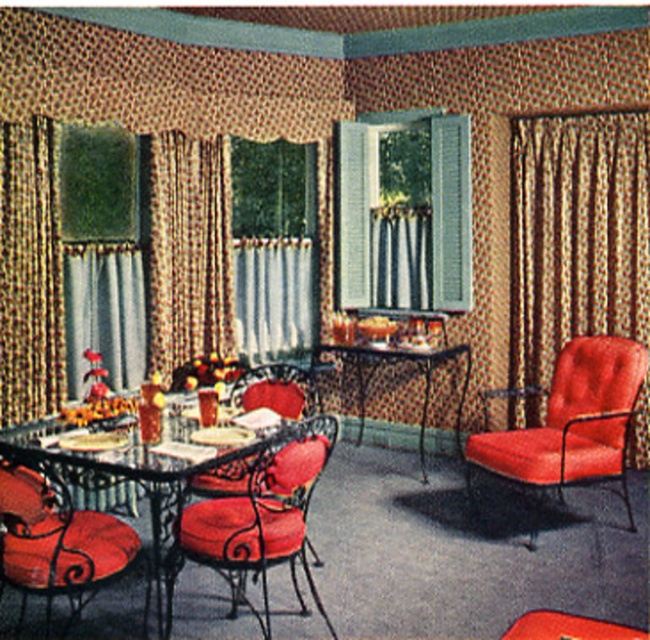
You are standing in the dining area and want to open the window to let some fresh air in. The window is located at the same position as the brown textured curtain at left. Can you reach the window if you are 1.7 meters tall?

The position of the brown textured curtain at left is at point (185,248). Since the window is at the same position, and assuming the coordinates are normalized between 0 and 1, the vertical position 0.286 would correspond to roughly 0.286 multiplied by the room height. If the room height is standard, say 2.5 meters, the window would be at about 0.715 meters from the floor. Since you are 1.7 meters tall, you can easily reach the window.

Consider the image. You are planning to hang a 12 inch wide painting between the brown textured curtain at left and the white sheer curtain at center. Is there enough space between them to fit the painting?

The brown textured curtain at left is 20.66 inches from the white sheer curtain at center. Since the painting is 12 inches wide, there is enough space between them to fit the painting.

You are a guest entering the dining area and notice the brown textured curtain at left and the white sheer curtain at center. Which curtain is positioned higher relative to the other?

The brown textured curtain at left is positioned higher than the white sheer curtain at center because it is above it.